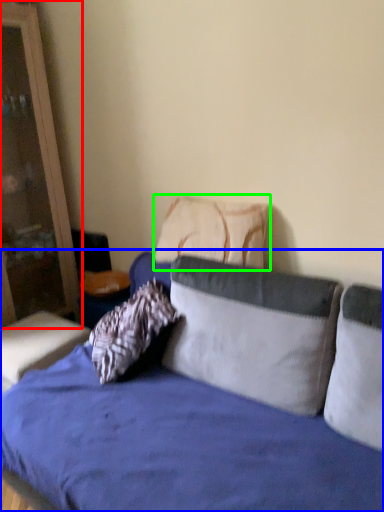
Question: Which object is the closest to the dresser (highlighted by a red box)? Choose among these: studio couch (highlighted by a blue box) or pillow (highlighted by a green box).

Choices:
 (A) studio couch
 (B) pillow

Answer: (A)